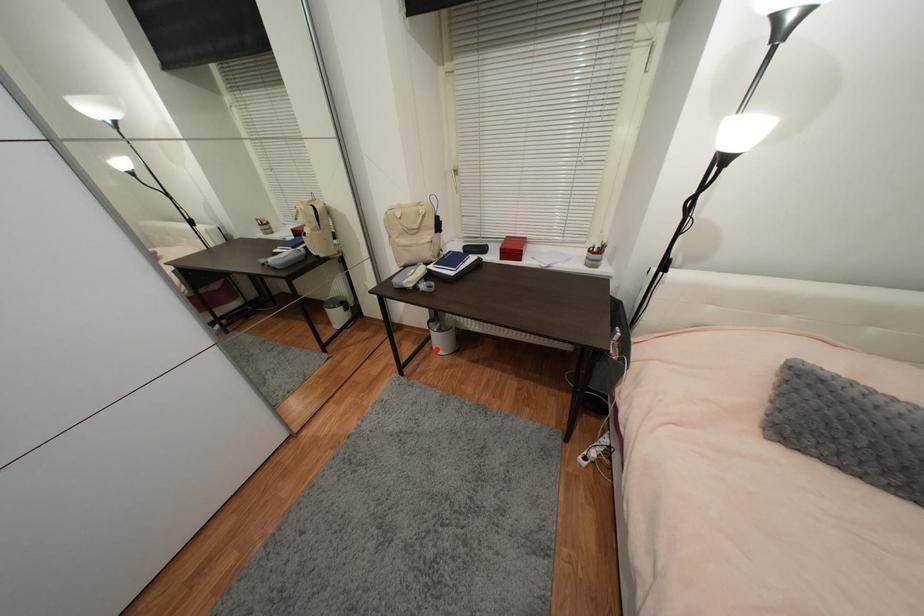
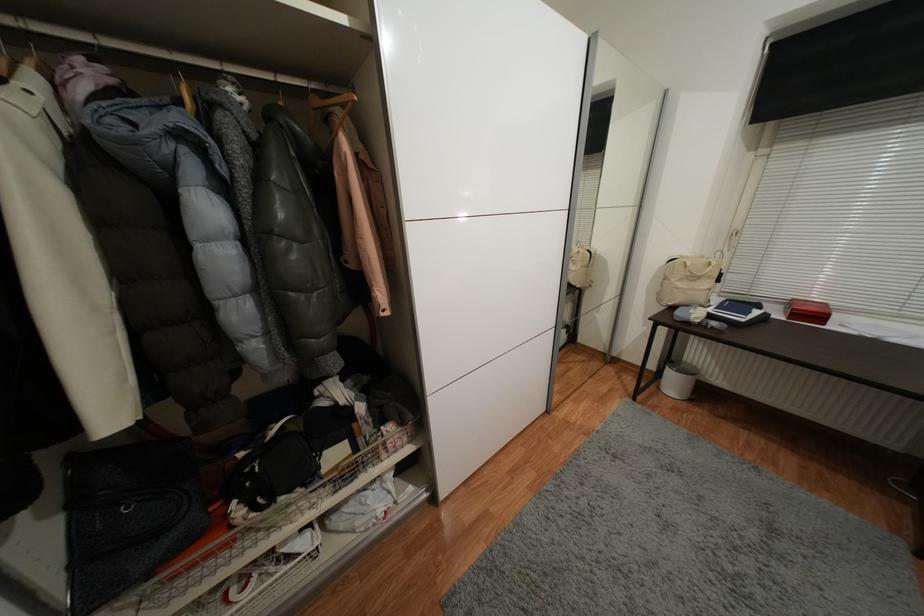
Locate, in the second image, the point that corresponds to the highlighted location in the first image.

(663, 390)